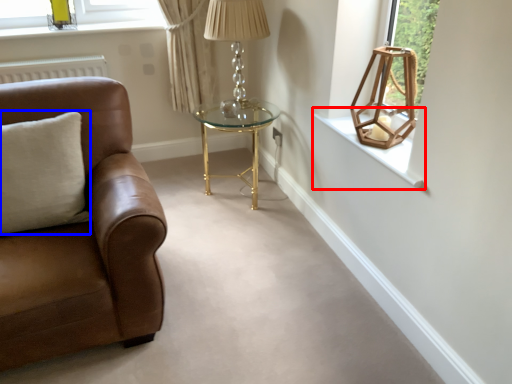
Question: Among these objects, which one is farthest to the camera, window sill (highlighted by a red box) or pillow (highlighted by a blue box)?

Choices:
 (A) window sill
 (B) pillow

Answer: (A)